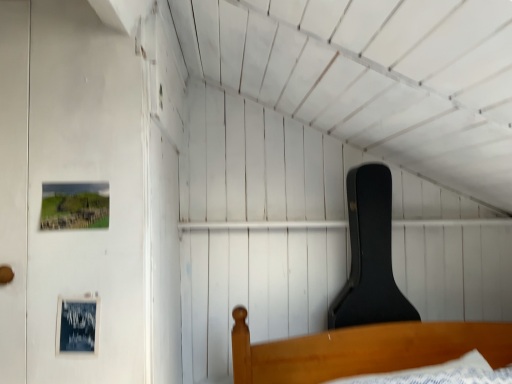
Question: Should I look upward or downward to see black matte guitar case at upper right?

Choices:
 (A) down
 (B) up

Answer: (A)